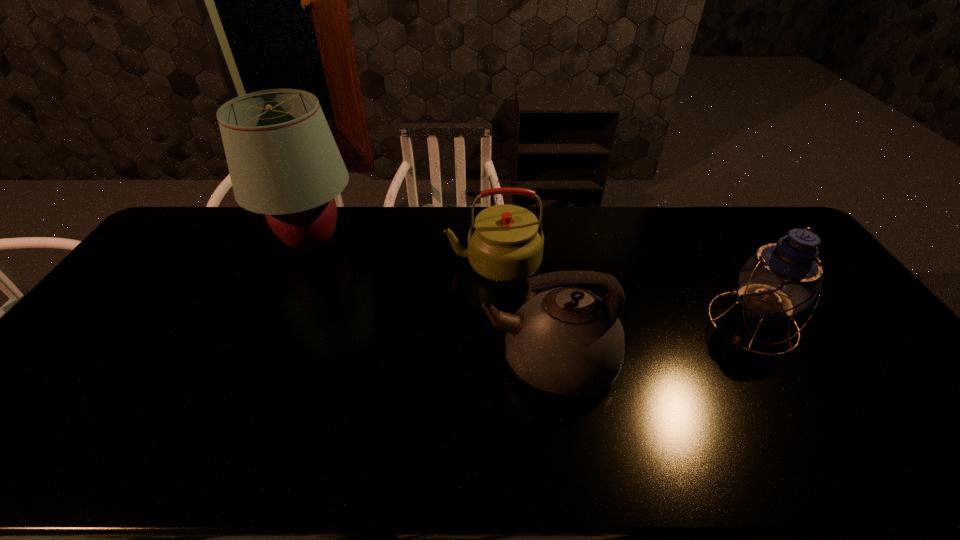
The width and height of the screenshot is (960, 540). What are the coordinates of `the fourth closest object to the rightmost object` in the screenshot? It's located at (178, 415).